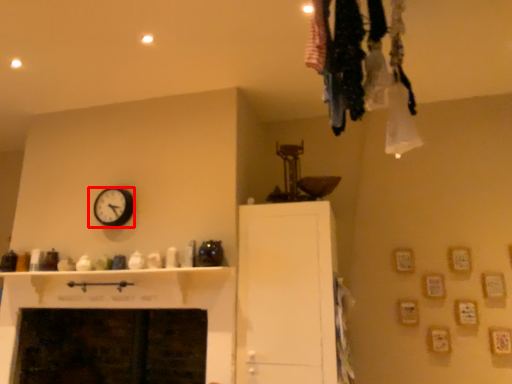
Question: From the image's perspective, considering the relative positions of wall clock (annotated by the red box) and cabinetry in the image provided, where is wall clock (annotated by the red box) located with respect to the staircase?

Choices:
 (A) above
 (B) below

Answer: (A)